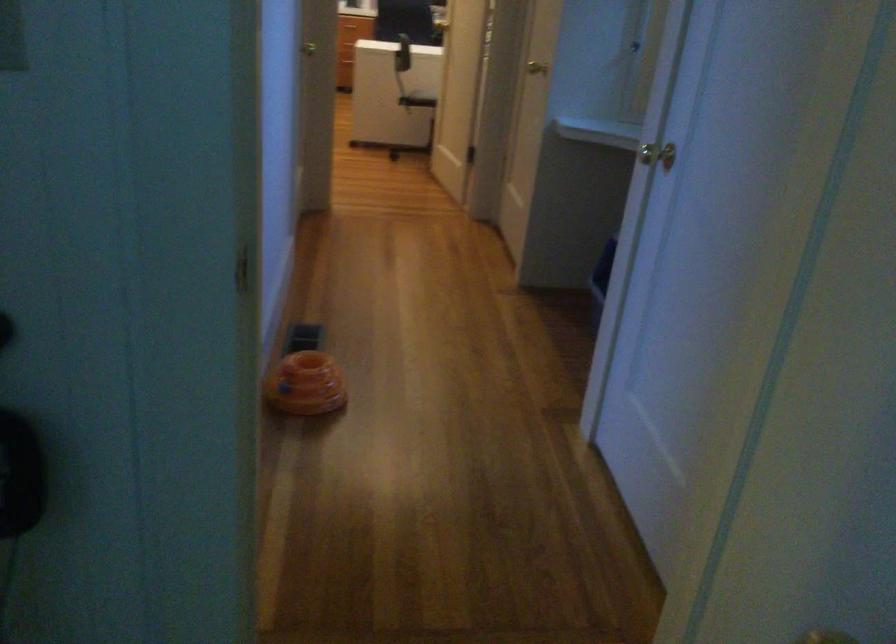
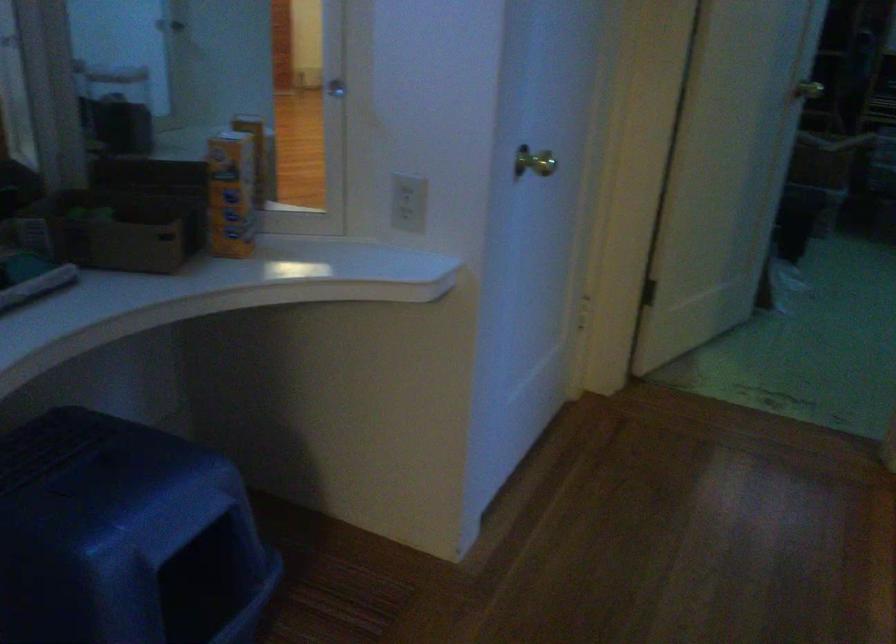
The point at (666, 154) is marked in the first image. Where is the corresponding point in the second image?

(533, 162)